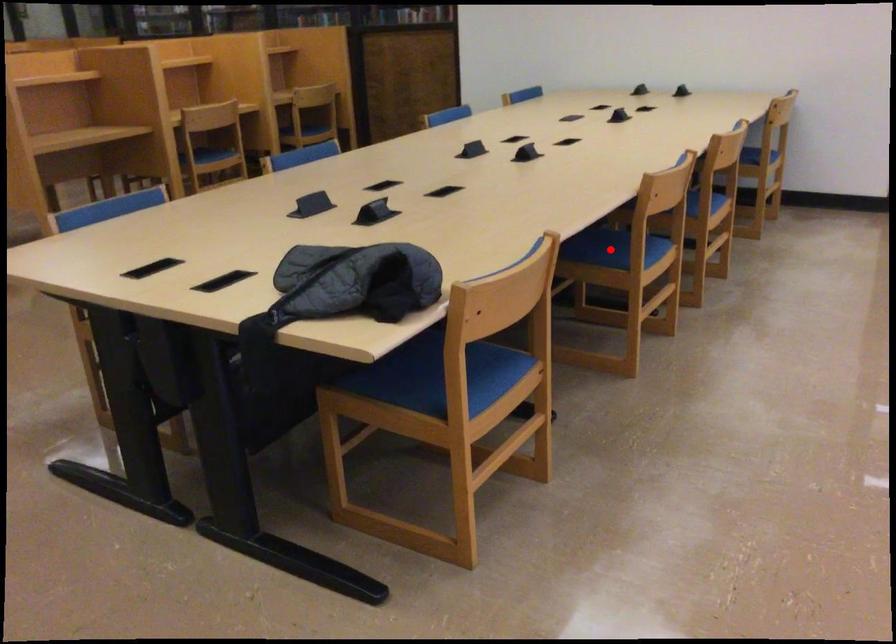
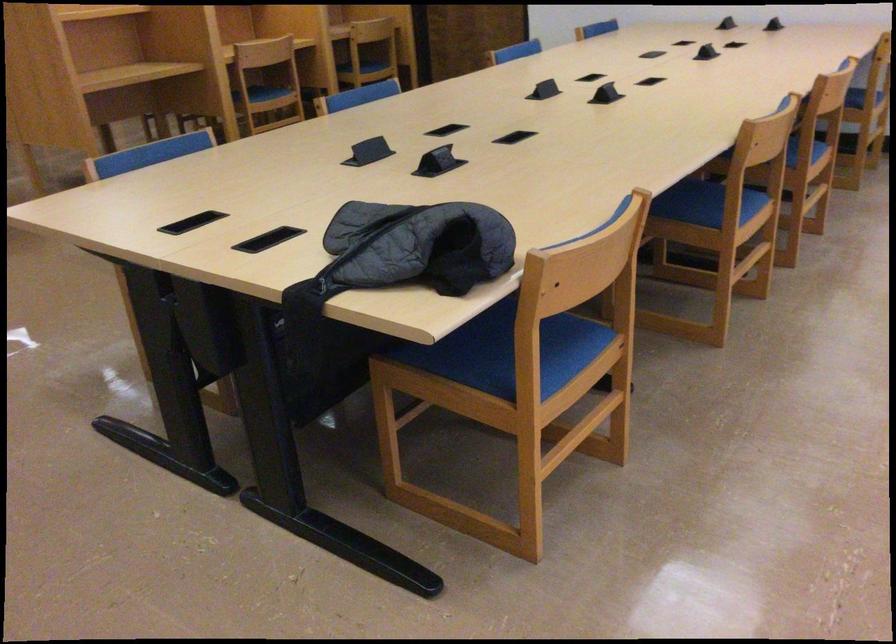
Question: I am providing you with two images of the same scene from different viewpoints. In image1, a red point is highlighted. Considering the same 3D point in image2, which of the following is correct?

Choices:
 (A) It is closer
 (B) It is farther

Answer: (A)